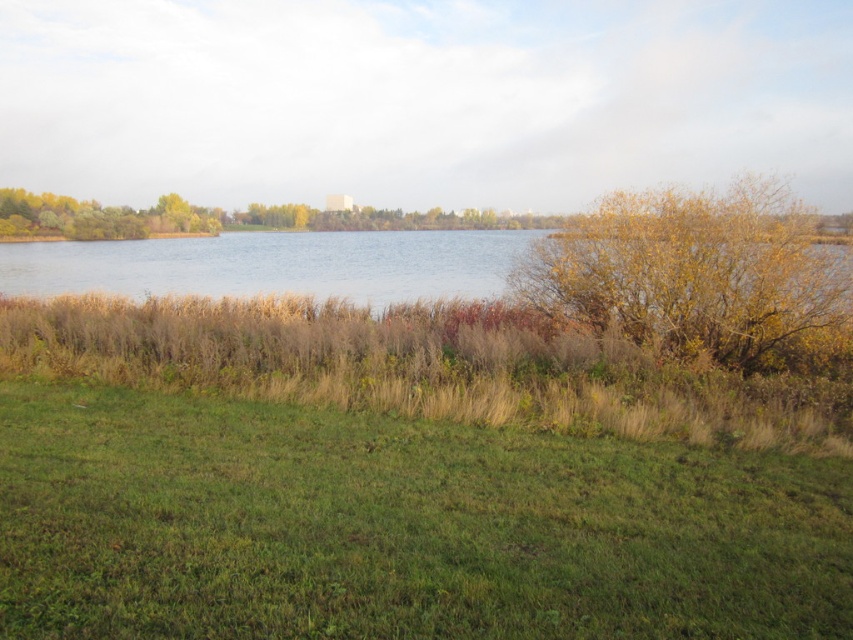
You are standing at the edge of the lake and see the green grassy at lower center and the brown grassy lake at center. Which area is closer to you?

The green grassy at lower center is closer to you because it is positioned below the brown grassy lake at center, indicating it is nearer in the scene.

Based on the scene description, what is located at the coordinates point (x=398, y=528)?

The coordinates point (x=398, y=528) is located at the green grassy area at lower center.